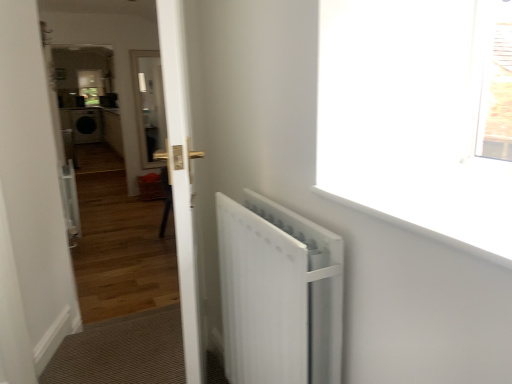
Question: Considering the relative sizes of white smooth window sill at upper right and white matte radiator at right in the image provided, is white smooth window sill at upper right wider than white matte radiator at right?

Choices:
 (A) no
 (B) yes

Answer: (B)

Question: Is white smooth window sill at upper right beside white matte radiator at right?

Choices:
 (A) yes
 (B) no

Answer: (B)

Question: Is white smooth window sill at upper right thinner than white matte radiator at right?

Choices:
 (A) yes
 (B) no

Answer: (B)

Question: Is white smooth window sill at upper right not close to white matte radiator at right?

Choices:
 (A) yes
 (B) no

Answer: (B)

Question: Is white smooth window sill at upper right to the left of white matte radiator at right from the viewer's perspective?

Choices:
 (A) no
 (B) yes

Answer: (A)

Question: Is white matte radiator at right located within white smooth window sill at upper right?

Choices:
 (A) yes
 (B) no

Answer: (B)

Question: From a real-world perspective, is white glossy door at center physically below white glossy door at center?

Choices:
 (A) no
 (B) yes

Answer: (B)

Question: From the image's perspective, is white glossy door at center below white glossy door at center?

Choices:
 (A) no
 (B) yes

Answer: (B)

Question: Is white glossy door at center smaller than white glossy door at center?

Choices:
 (A) no
 (B) yes

Answer: (A)

Question: Is white glossy door at center positioned behind white glossy door at center?

Choices:
 (A) yes
 (B) no

Answer: (B)

Question: Does white glossy door at center turn towards white glossy door at center?

Choices:
 (A) yes
 (B) no

Answer: (A)

Question: Is white glossy door at center located outside white glossy door at center?

Choices:
 (A) no
 (B) yes

Answer: (B)

Question: Considering the relative positions of white smooth window sill at upper right and white glossy door at center in the image provided, is white smooth window sill at upper right in front of white glossy door at center?

Choices:
 (A) no
 (B) yes

Answer: (B)